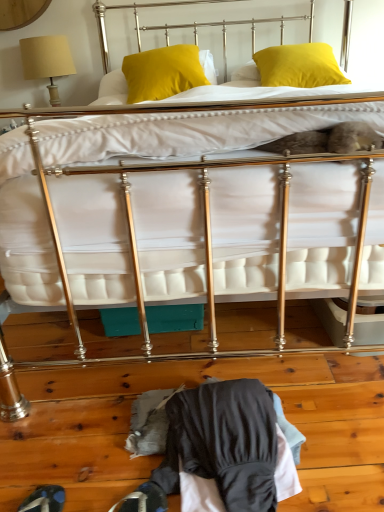
Question: Is yellow velvet pillow at upper center, the 1th pillow in the left-to-right sequence, inside the boundaries of beige fabric lampshade at upper left, or outside?

Choices:
 (A) outside
 (B) inside

Answer: (A)

Question: Considering the positions of yellow velvet pillow at upper center, placed as the 2th pillow when sorted from right to left, and beige fabric lampshade at upper left in the image, is yellow velvet pillow at upper center, placed as the 2th pillow when sorted from right to left, taller or shorter than beige fabric lampshade at upper left?

Choices:
 (A) short
 (B) tall

Answer: (A)

Question: Considering the real-world distances, which object is farthest from the yellow matte pillow at upper right, the second pillow viewed from the left?

Choices:
 (A) dark blue leather shoe at lower left
 (B) dark gray fabric at lower center
 (C) yellow velvet pillow at upper center, placed as the 2th pillow when sorted from right to left
 (D) beige fabric lampshade at upper left

Answer: (A)

Question: Which object is the closest to the yellow velvet pillow at upper center, placed as the 2th pillow when sorted from right to left?

Choices:
 (A) dark blue leather shoe at lower left
 (B) yellow matte pillow at upper right, the second pillow viewed from the left
 (C) dark gray fabric at lower center
 (D) beige fabric lampshade at upper left

Answer: (B)